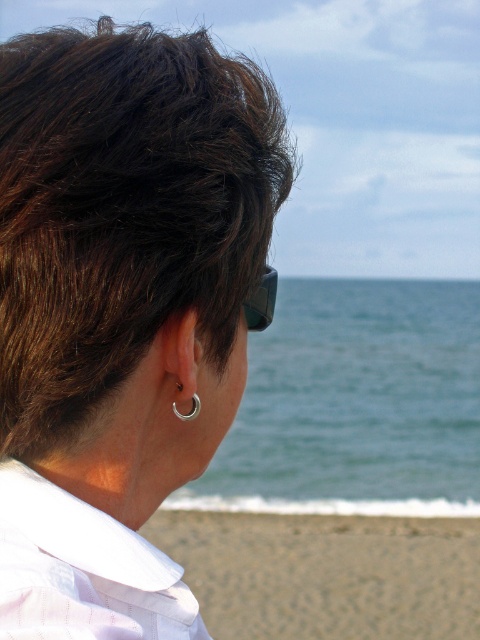
You are a photographer trying to capture a shot of the person and the beach. You need to know if the sandy beach at lower right will appear larger than the matte black goggles at upper center in the photo. Can you confirm?

The sandy beach at lower right is taller than the matte black goggles at upper center, so yes, the sandy beach at lower right will appear larger in the photo.

In the scene shown: You are a photographer trying to capture the perfect shot of the dark brown hair at center and the white striped shirt at center. Based on their heights, which object should you focus on first if you want to ensure both are in the frame without adjusting your camera angle?

The dark brown hair at center is taller than the white striped shirt at center, so you should focus on the dark brown hair at center first to ensure both are in the frame without adjusting your camera angle.

In the scene shown: You are a photographer trying to capture the entire sandy beach at lower right and matte black goggles at upper center in one shot. Based on their widths, will both objects fit side by side horizontally in the frame?

The sandy beach at lower right might be wider than matte black goggles at upper center, so there is a possibility that both can fit side by side horizontally in the frame depending on their exact widths.